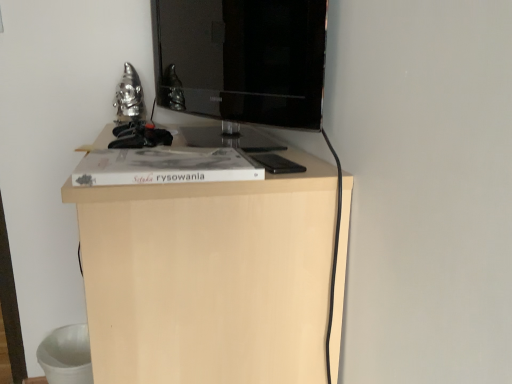
Question: Looking at the image, does matte black tv at center seem bigger or smaller compared to light wood cabinet at center?

Choices:
 (A) big
 (B) small

Answer: (B)

Question: Visually, is matte black tv at center positioned to the left or to the right of light wood cabinet at center?

Choices:
 (A) right
 (B) left

Answer: (A)

Question: In the image, is matte black tv at center positioned in front of or behind light wood cabinet at center?

Choices:
 (A) behind
 (B) front

Answer: (A)

Question: In the image, is light wood cabinet at center positioned in front of or behind matte black tv at center?

Choices:
 (A) behind
 (B) front

Answer: (B)

Question: Is light wood cabinet at center spatially inside matte black tv at center, or outside of it?

Choices:
 (A) inside
 (B) outside

Answer: (B)

Question: From the image's perspective, is light wood cabinet at center positioned above or below matte black tv at center?

Choices:
 (A) below
 (B) above

Answer: (A)

Question: In the image, is light wood cabinet at center on the left side or the right side of matte black tv at center?

Choices:
 (A) right
 (B) left

Answer: (B)